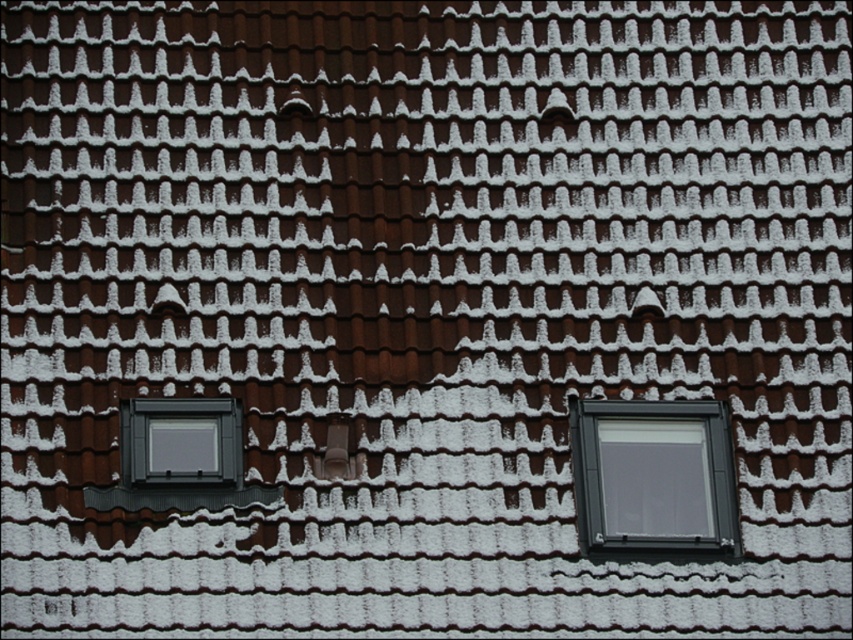
Does matte gray window at right appear on the left side of matte gray window at lower left?

In fact, matte gray window at right is to the right of matte gray window at lower left.

Which is behind, point (682, 540) or point (166, 404)?

The point (166, 404) is behind.

Where is `matte gray window at right`? matte gray window at right is located at coordinates (653, 476).